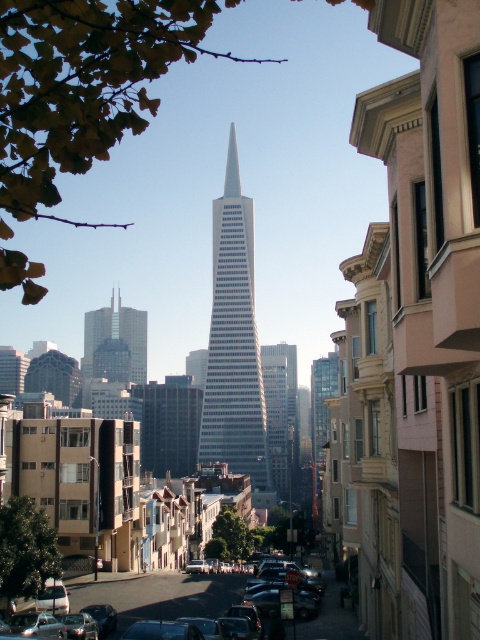
Question: From the image, what is the correct spatial relationship of white glass skyscraper at center in relation to matte glass skyscraper at center?

Choices:
 (A) right
 (B) left

Answer: (A)

Question: Does white glass skyscraper at center have a larger size compared to metallic silver car at center?

Choices:
 (A) yes
 (B) no

Answer: (A)

Question: Does white glass skyscraper at center have a lesser width compared to matte glass skyscraper at center?

Choices:
 (A) yes
 (B) no

Answer: (A)

Question: Which of the following is the farthest from the observer?

Choices:
 (A) (229, 243)
 (B) (187, 580)

Answer: (A)

Question: Which point is closer to the camera taking this photo?

Choices:
 (A) (106, 342)
 (B) (236, 419)

Answer: (B)

Question: Which is nearer to the metallic silver car at center?

Choices:
 (A) matte glass skyscraper at center
 (B) white glass skyscraper at center

Answer: (B)